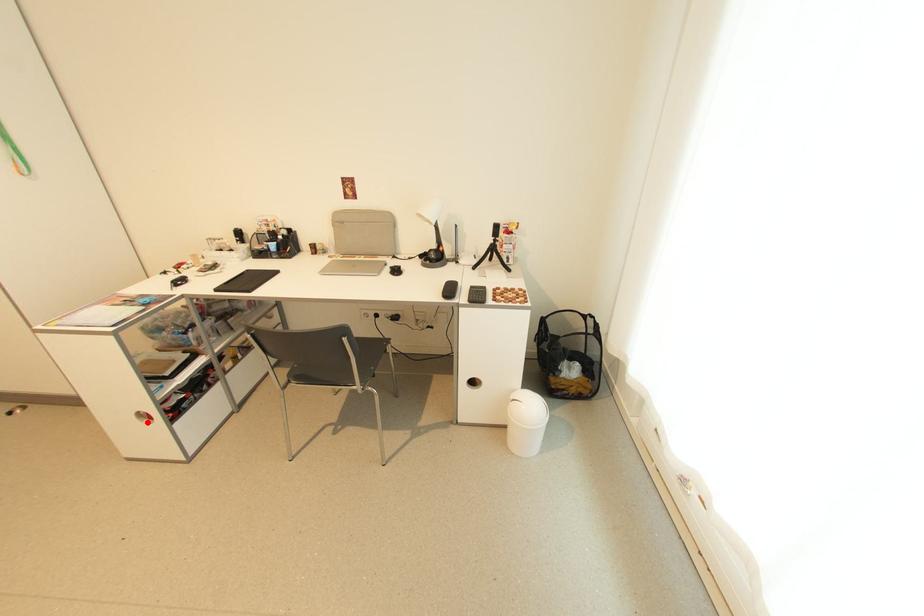
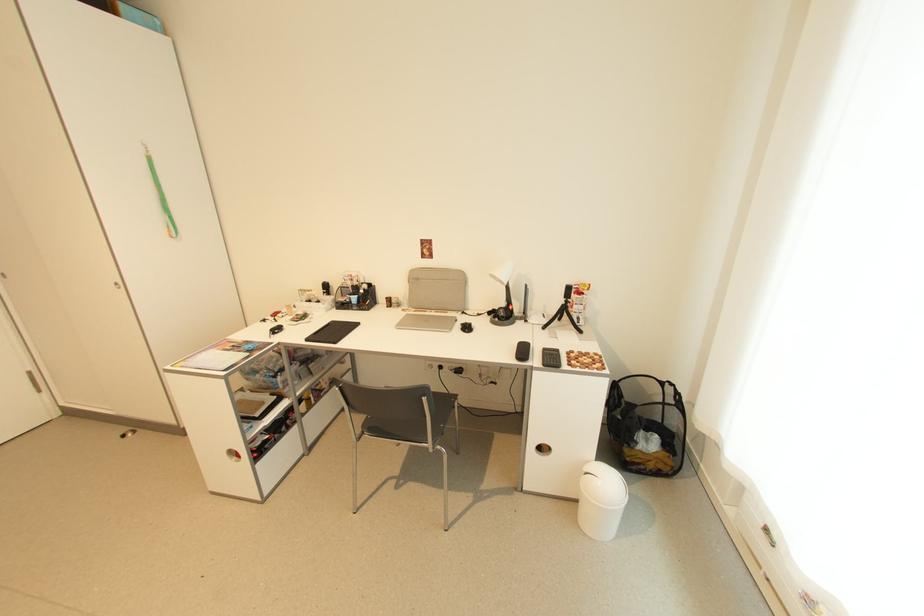
Where in the second image is the point corresponding to the highlighted location from the first image?

(237, 460)